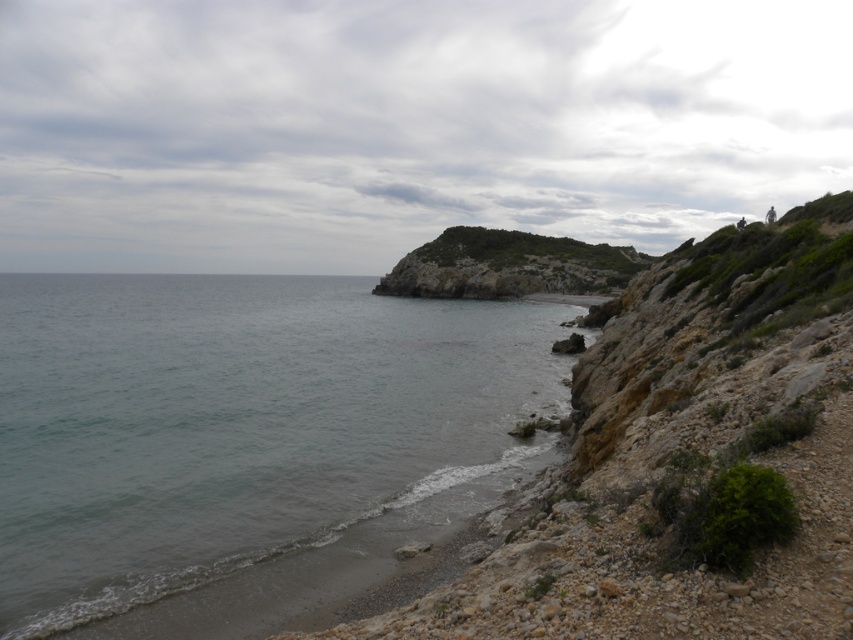
You are a hiker who wants to cross from the clear water at lower left to the green rocky hillside at center. Considering their heights, which one is lower and easier to step onto?

The clear water at lower left has a lesser height compared to the green rocky hillside at center, so it is lower and easier to step onto.

You are standing at the center of the image and want to find the clear water at lower left. According to the coordinates provided, in which direction should you move to reach it?

The clear water at lower left is located at point 0.691 on the x axis and 0.286 on the y axis. Since you are at the center, you should move to the left and down to reach it.

You are a kayaker planning to navigate through the coastal area shown in the image. You need to determine the safest path. Based on the scene, which area would allow your kayak to pass through more easily, the clear water at lower left or the green rocky hillside at center?

The clear water at lower left is wider than the green rocky hillside at center, so the kayak can pass through the clear water at lower left more easily.